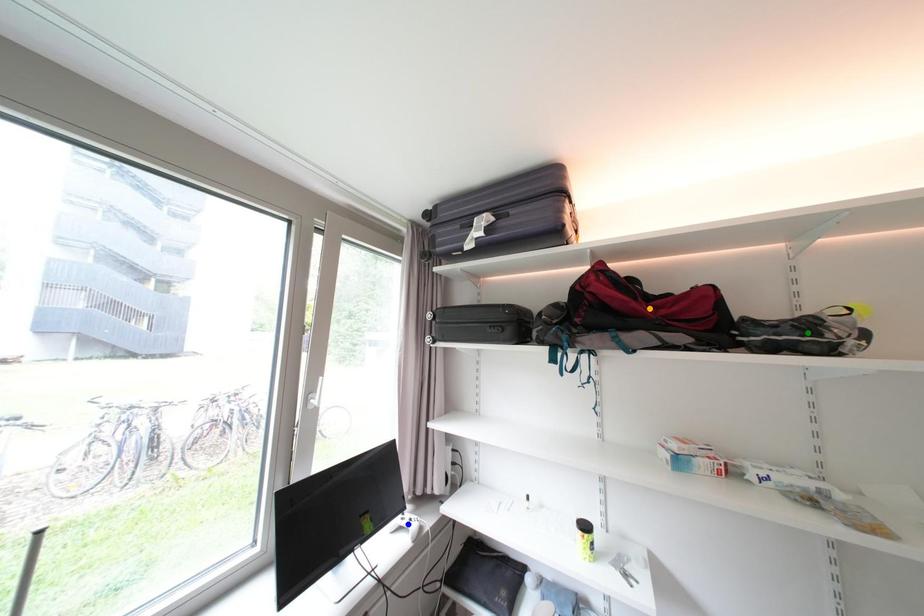
Order these from nearest to farthest:
- blue point
- green point
- orange point

green point
orange point
blue point